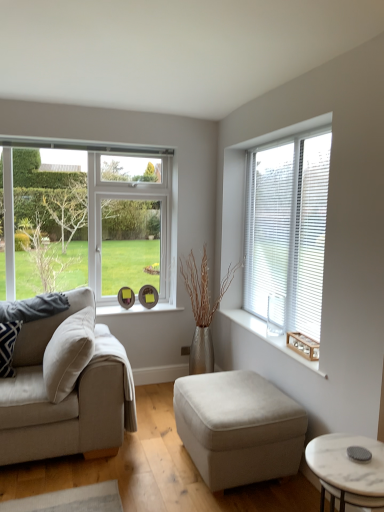
This screenshot has height=512, width=384. Identify the location of free space above clear glass window at left, marked as the second window in a right-to-left arrangement (from a real-world perspective). (85, 151).